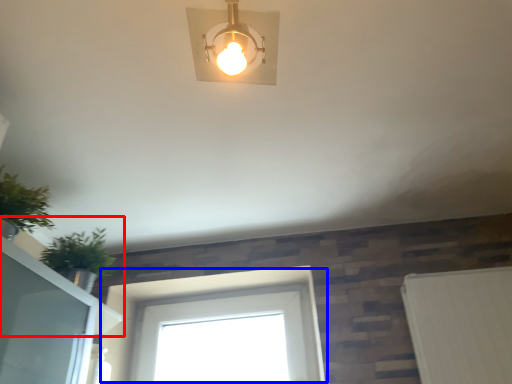
Question: Which point is further to the camera, window sill (highlighted by a red box) or window (highlighted by a blue box)?

Choices:
 (A) window sill
 (B) window

Answer: (B)